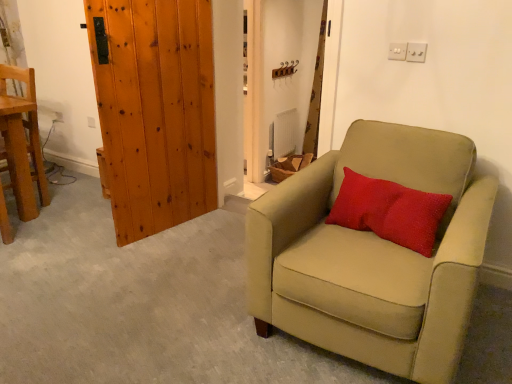
This screenshot has height=384, width=512. Describe the element at coordinates (57, 117) in the screenshot. I see `white plastic electric outlet at lower left` at that location.

What is the approximate width of red textured pillow at center?

red textured pillow at center is 8.00 inches wide.

The width and height of the screenshot is (512, 384). I want to click on red textured pillow at center, so click(x=389, y=211).

This screenshot has width=512, height=384. What do you see at coordinates (29, 124) in the screenshot?
I see `wooden chair at left, which ranks as the first chair in left-to-right order` at bounding box center [29, 124].

What is the approximate height of wooden plank door at left?

It is 4.43 feet.

Image resolution: width=512 pixels, height=384 pixels. What do you see at coordinates (155, 110) in the screenshot?
I see `wooden plank door at left` at bounding box center [155, 110].

Identify the location of suede beige armchair at right, marked as the second chair in a back-to-front arrangement. (373, 255).

This screenshot has width=512, height=384. Find the location of `matte brown curtain at upper center`. matte brown curtain at upper center is located at coordinates (316, 92).

Based on the photo, would you say matte brown curtain at upper center is inside or outside red textured pillow at center?

matte brown curtain at upper center is spatially situated outside red textured pillow at center.

Is matte brown curtain at upper center not close to red textured pillow at center?

That's right, there is a large distance between matte brown curtain at upper center and red textured pillow at center.

Is point (314, 94) positioned behind point (375, 220)?

Yes, point (314, 94) is behind point (375, 220).

What's the angular difference between matte brown curtain at upper center and red textured pillow at center's facing directions?

They differ by 2.62 degrees in their facing directions.

Is wooden chair at left, the first chair viewed from the back, turned away from white plastic electric outlet at lower left?

No, white plastic electric outlet at lower left is not at the back of wooden chair at left, the first chair viewed from the back.

Is point (25, 73) positioned before point (54, 122)?

That is True.

Between wooden chair at left, which ranks as the first chair in left-to-right order, and white plastic electric outlet at lower left, which one appears on the right side from the viewer's perspective?

white plastic electric outlet at lower left is more to the right.

The width and height of the screenshot is (512, 384). What are the coordinates of `curtain above the white plastic electric outlet at lower left (from a real-world perspective)` in the screenshot? It's located at (316, 92).

Does point (309, 151) come in front of point (54, 113)?

No, it is behind (54, 113).

Are matte brown curtain at upper center and white plastic electric outlet at lower left far apart?

Absolutely, matte brown curtain at upper center is distant from white plastic electric outlet at lower left.

Is matte brown curtain at upper center surrounded by suede beige armchair at right, positioned as the second chair in left-to-right order?

No.

From a real-world perspective, is suede beige armchair at right, positioned as the second chair in left-to-right order, positioned above or below matte brown curtain at upper center?

In terms of real-world spatial position, suede beige armchair at right, positioned as the second chair in left-to-right order, is below matte brown curtain at upper center.

Could you tell me if suede beige armchair at right, which is the first chair from front to back, is facing matte brown curtain at upper center?

No.

Which object is positioned more to the left, suede beige armchair at right, which is the first chair in right-to-left order, or matte brown curtain at upper center?

From the viewer's perspective, suede beige armchair at right, which is the first chair in right-to-left order, appears more on the left side.

Who is taller, wooden plank door at left or matte brown curtain at upper center?

matte brown curtain at upper center is taller.

From the picture: How different are the orientations of wooden plank door at left and matte brown curtain at upper center in degrees?

wooden plank door at left and matte brown curtain at upper center are facing 76 degrees away from each other.

Is wooden plank door at left oriented away from matte brown curtain at upper center?

No.

Identify the location of door below the matte brown curtain at upper center (from the image's perspective). [155, 110].

Between white plastic electric outlet at lower left and matte brown curtain at upper center, which one is positioned behind?

matte brown curtain at upper center is behind.

Considering the relative positions of white plastic electric outlet at lower left and matte brown curtain at upper center in the image provided, is white plastic electric outlet at lower left to the left or to the right of matte brown curtain at upper center?

Based on their positions, white plastic electric outlet at lower left is located to the left of matte brown curtain at upper center.

Is white plastic electric outlet at lower left turned away from matte brown curtain at upper center?

No, white plastic electric outlet at lower left is not facing the opposite direction of matte brown curtain at upper center.

Which of these two, white plastic electric outlet at lower left or matte brown curtain at upper center, stands shorter?

With less height is white plastic electric outlet at lower left.

Is wooden chair at left, the second chair when ordered from front to back, bigger or smaller than wooden plank door at left?

In the image, wooden chair at left, the second chair when ordered from front to back, appears to be smaller than wooden plank door at left.

Based on the photo, considering the relative positions of wooden chair at left, which ranks as the first chair in left-to-right order, and wooden plank door at left in the image provided, is wooden chair at left, which ranks as the first chair in left-to-right order, to the right of wooden plank door at left from the viewer's perspective?

Incorrect, wooden chair at left, which ranks as the first chair in left-to-right order, is not on the right side of wooden plank door at left.

How many degrees apart are the facing directions of wooden chair at left, the second chair when ordered from front to back, and wooden plank door at left?

The angular difference between wooden chair at left, the second chair when ordered from front to back, and wooden plank door at left is 77.1 degrees.

Looking at this image, which is closer to the camera, (38, 184) or (125, 149)?

Point (125, 149)

What are the coordinates of `curtain located behind the red textured pillow at center` in the screenshot? It's located at (316, 92).

Where is `electric outlet directly beneath the wooden chair at left, the second chair when ordered from front to back (from a real-world perspective)`? The image size is (512, 384). electric outlet directly beneath the wooden chair at left, the second chair when ordered from front to back (from a real-world perspective) is located at coordinates (57, 117).

Based on their spatial positions, is matte brown curtain at upper center or red textured pillow at center further from wooden chair at left, the second chair when ordered from front to back?

Among the two, matte brown curtain at upper center is located further to wooden chair at left, the second chair when ordered from front to back.

Estimate the real-world distances between objects in this image. Which object is closer to suede beige armchair at right, marked as the second chair in a back-to-front arrangement, wooden plank door at left or wooden chair at left, the second chair when ordered from front to back?

The object closer to suede beige armchair at right, marked as the second chair in a back-to-front arrangement, is wooden plank door at left.

Looking at the image, which one is located further to suede beige armchair at right, marked as the second chair in a back-to-front arrangement, matte brown curtain at upper center or red textured pillow at center?

matte brown curtain at upper center.

Considering their positions, is wooden plank door at left positioned closer to matte brown curtain at upper center than red textured pillow at center?

Based on the image, wooden plank door at left appears to be nearer to matte brown curtain at upper center.

Considering their positions, is wooden chair at left, which is the second chair in right-to-left order, positioned closer to suede beige armchair at right, which is the first chair in right-to-left order, than wooden plank door at left?

Among the two, wooden plank door at left is located nearer to suede beige armchair at right, which is the first chair in right-to-left order.

Estimate the real-world distances between objects in this image. Which object is closer to wooden chair at left, the first chair viewed from the back, red textured pillow at center or matte brown curtain at upper center?

red textured pillow at center is positioned closer to the anchor wooden chair at left, the first chair viewed from the back.

From the image, which object appears to be nearer to wooden plank door at left, suede beige armchair at right, positioned as the second chair in left-to-right order, or red textured pillow at center?

Based on the image, suede beige armchair at right, positioned as the second chair in left-to-right order, appears to be nearer to wooden plank door at left.

In the scene shown: From the image, which object appears to be nearer to matte brown curtain at upper center, white plastic electric outlet at lower left or suede beige armchair at right, which is the first chair in right-to-left order?

Based on the image, white plastic electric outlet at lower left appears to be nearer to matte brown curtain at upper center.

Where is `door between red textured pillow at center and matte brown curtain at upper center in the front-back direction`? Image resolution: width=512 pixels, height=384 pixels. door between red textured pillow at center and matte brown curtain at upper center in the front-back direction is located at coordinates (155, 110).

Locate an element on the screen. This screenshot has height=384, width=512. door between wooden chair at left, which is the second chair in right-to-left order, and matte brown curtain at upper center from left to right is located at coordinates (155, 110).

Locate an element on the screen. Image resolution: width=512 pixels, height=384 pixels. door located between wooden chair at left, the first chair viewed from the back, and red textured pillow at center in the left-right direction is located at coordinates (155, 110).

I want to click on electric outlet between wooden chair at left, which ranks as the first chair in left-to-right order, and red textured pillow at center, in the horizontal direction, so click(x=57, y=117).